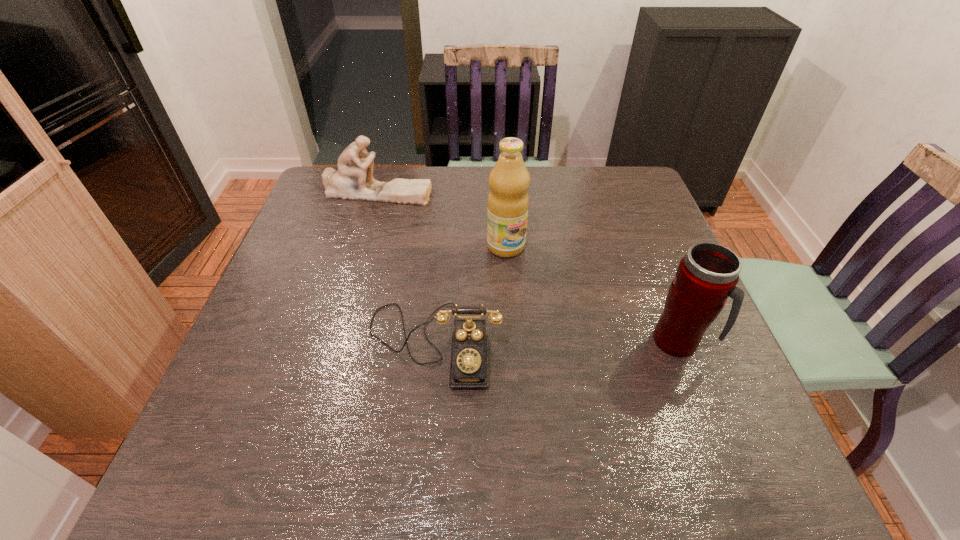
I want to click on free space that is in between the shortest object and the thermos bottle, so click(x=556, y=343).

Identify the location of vacant space that is in between the farthest object and the shortest object. (405, 268).

This screenshot has width=960, height=540. I want to click on unoccupied area between the tallest object and the figurine, so pyautogui.click(x=441, y=219).

The width and height of the screenshot is (960, 540). I want to click on free space that is in between the rightmost object and the figurine, so click(x=527, y=267).

Locate an element on the screen. the third closest object to the telephone is located at coordinates (354, 180).

Select which object appears as the closest to the farthest object. Please provide its 2D coordinates. Your answer should be formatted as a tuple, i.e. [(x, y)], where the tuple contains the x and y coordinates of a point satisfying the conditions above.

[(508, 201)]

In order to click on vacant space that satisfies the following two spatial constraints: 1. on the front side of the rightmost object; 2. on the side with the handle of the tallest object in this screenshot , I will do `click(512, 342)`.

Image resolution: width=960 pixels, height=540 pixels. I want to click on vacant region that satisfies the following two spatial constraints: 1. on the front side of the third shortest object; 2. on the side with the handle of the olive oil, so click(x=512, y=342).

Locate an element on the screen. vacant region that satisfies the following two spatial constraints: 1. on the front side of the tallest object; 2. on the side with the handle of the thermos bottle is located at coordinates (512, 342).